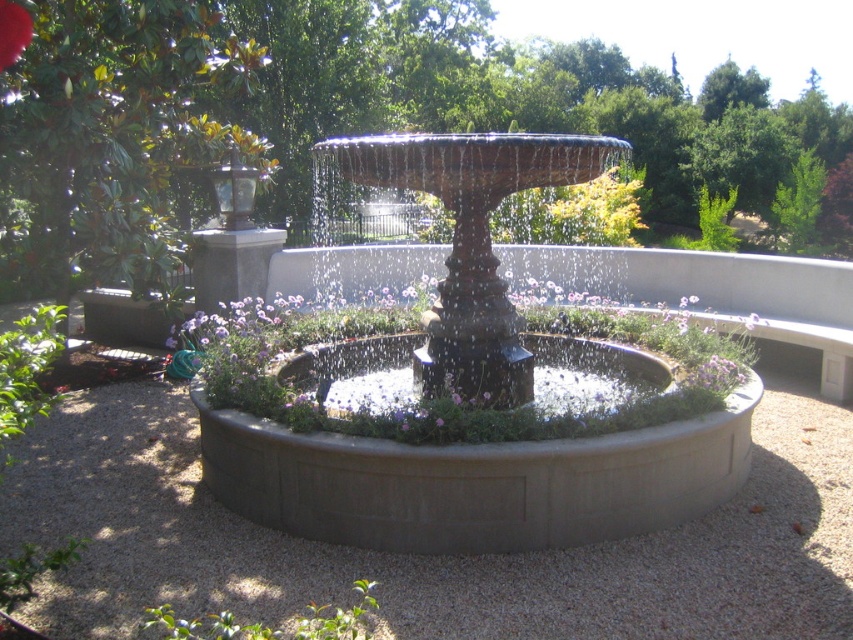
You are a gardener who wants to plant a new flower that requires at least 1.2 meters of space between it and the existing purple matte flower at center. You have a spot in the gray gravel at center. Is this spot suitable?

The gray gravel at center is 1.13 meters away from the purple matte flower at center. Since the required distance is 1.2 meters, the spot in the gray gravel at center is not suitable for planting the new flower.

You are a gardener who needs to install a new light fixture. You have two options for placement. One is near the dark brown stone fountain at center, and the other is near the red matte flower at center. Which location would provide better coverage for the entire garden area?

The dark brown stone fountain at center is much taller than the red matte flower at center, so placing the light fixture near the dark brown stone fountain at center would provide better coverage for the entire garden area.